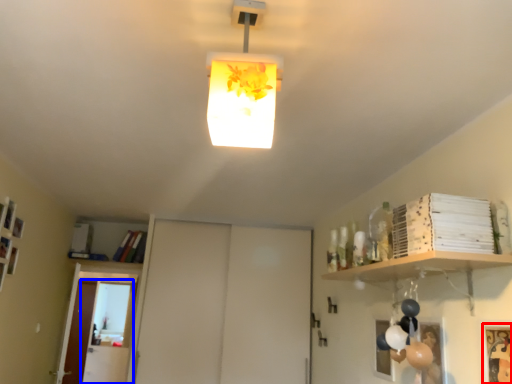
Question: Among these objects, which one is nearest to the camera, picture frame (highlighted by a red box) or glass door (highlighted by a blue box)?

Choices:
 (A) picture frame
 (B) glass door

Answer: (A)